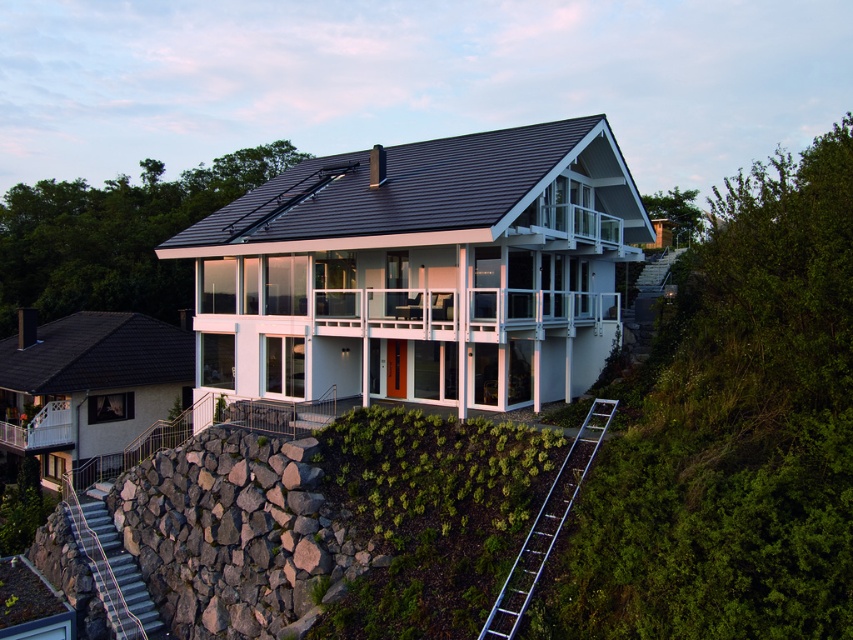
Question: Which object is positioned farthest from the white glass railing at center?

Choices:
 (A) rustic stone stairs at lower left
 (B) silver metallic ladder at lower right

Answer: (B)

Question: Is white glass railing at center above rustic stone stairs at lower left?

Choices:
 (A) yes
 (B) no

Answer: (A)

Question: Can you confirm if silver metallic ladder at lower right is positioned above rustic stone stairs at lower left?

Choices:
 (A) no
 (B) yes

Answer: (B)

Question: Estimate the real-world distances between objects in this image. Which object is closer to the silver metallic ladder at lower right?

Choices:
 (A) rustic stone stairs at lower left
 (B) white glass railing at center

Answer: (B)

Question: Which of the following is the farthest from the observer?

Choices:
 (A) (563, 460)
 (B) (90, 525)
 (C) (412, 332)

Answer: (B)

Question: Is silver metallic ladder at lower right closer to the viewer compared to rustic stone stairs at lower left?

Choices:
 (A) no
 (B) yes

Answer: (B)